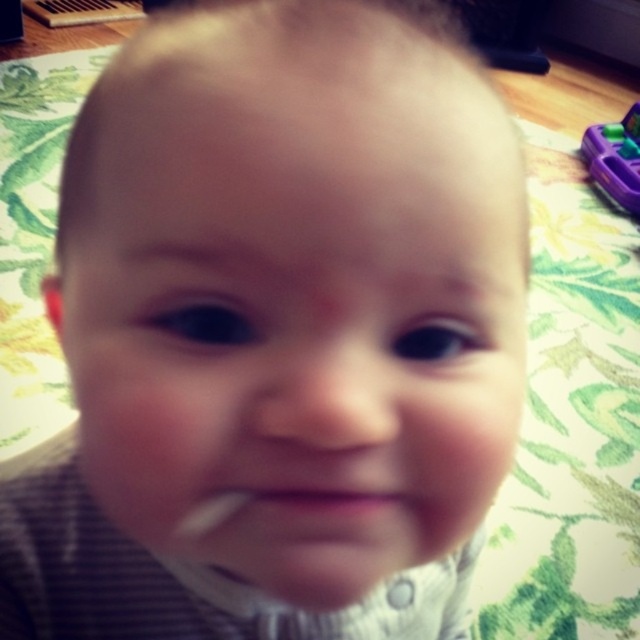
Question: Is pink matte lips at center thinner than white plastic toothbrush at lower center?

Choices:
 (A) yes
 (B) no

Answer: (B)

Question: Can you confirm if purple plastic toy at upper right is positioned above white plastic toothbrush at lower center?

Choices:
 (A) no
 (B) yes

Answer: (B)

Question: Considering the real-world distances, which object is farthest from the white plastic toothbrush at lower center?

Choices:
 (A) pink matte lips at center
 (B) purple plastic toy at upper right

Answer: (B)

Question: Where is pink matte lips at center located in relation to white plastic toothbrush at lower center in the image?

Choices:
 (A) left
 (B) right

Answer: (B)

Question: Which of the following is the farthest from the observer?

Choices:
 (A) white plastic toothbrush at lower center
 (B) pink matte lips at center
 (C) purple plastic toy at upper right

Answer: (C)

Question: Which of these objects is positioned farthest from the pink matte lips at center?

Choices:
 (A) purple plastic toy at upper right
 (B) white plastic toothbrush at lower center

Answer: (A)